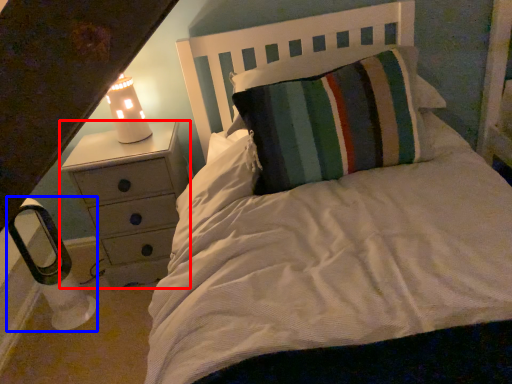
Question: Which object is closer to the camera taking this photo, chest of drawers (highlighted by a red box) or lamp (highlighted by a blue box)?

Choices:
 (A) chest of drawers
 (B) lamp

Answer: (B)